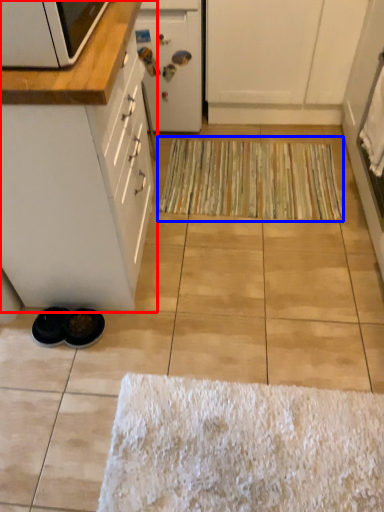
Question: Which point is further to the camera, cabinetry (highlighted by a red box) or doormat (highlighted by a blue box)?

Choices:
 (A) cabinetry
 (B) doormat

Answer: (B)